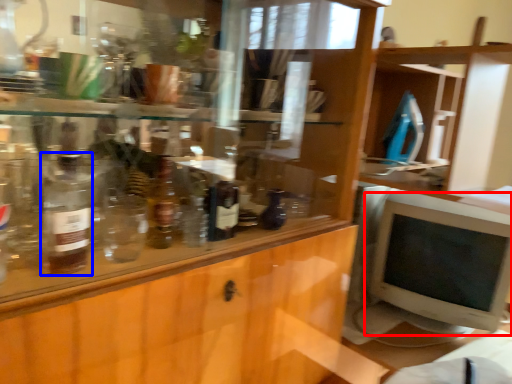
Question: Which object appears closest to the camera in this image, computer monitor (highlighted by a red box) or bottle (highlighted by a blue box)?

Choices:
 (A) computer monitor
 (B) bottle

Answer: (B)